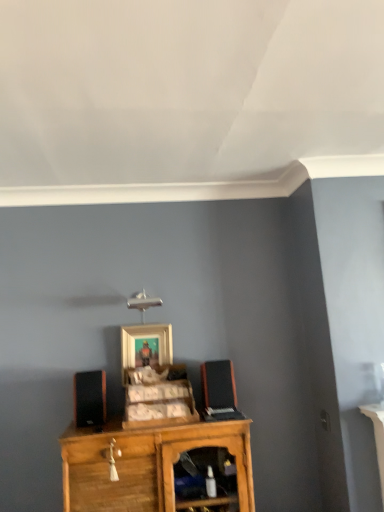
The height and width of the screenshot is (512, 384). What do you see at coordinates (145, 347) in the screenshot?
I see `wooden picture frame at center` at bounding box center [145, 347].

Where is `black matte speaker at right, marked as the 1th speaker in a right-to-left arrangement`? This screenshot has width=384, height=512. black matte speaker at right, marked as the 1th speaker in a right-to-left arrangement is located at coordinates (218, 384).

What do you see at coordinates (218, 384) in the screenshot?
I see `black matte speaker at right, which is the second speaker in left-to-right order` at bounding box center [218, 384].

Measure the distance between point (144,408) and camera.

2.04 meters.

I want to click on wooden picture frame at center, so click(x=145, y=347).

Which object is more forward, wooden cabinet at center or wooden cabinet at center?

Positioned in front is wooden cabinet at center.

Does point (212, 426) lie behind point (153, 416)?

No.

Is wooden cabinet at center turned away from wooden cabinet at center?

No, wooden cabinet at center is not facing the opposite direction of wooden cabinet at center.

From a real-world perspective, is wooden picture frame at center above or below black matte speaker at right, which is the second speaker in left-to-right order?

From a real-world perspective, wooden picture frame at center is physically above black matte speaker at right, which is the second speaker in left-to-right order.

Is wooden picture frame at center taller than black matte speaker at right, marked as the 1th speaker in a right-to-left arrangement?

Correct, wooden picture frame at center is much taller as black matte speaker at right, marked as the 1th speaker in a right-to-left arrangement.

From the picture: Is wooden picture frame at center not within black matte speaker at right, marked as the 1th speaker in a right-to-left arrangement?

Yes, wooden picture frame at center is outside of black matte speaker at right, marked as the 1th speaker in a right-to-left arrangement.

You are a GUI agent. You are given a task and a screenshot of the screen. Output one action in this format:
    pyautogui.click(x=<x>, y=<y>)
    Task: Click on the picture frame above the black matte speaker at right, marked as the 1th speaker in a right-to-left arrangement (from the image's perspective)
    The height and width of the screenshot is (512, 384).
    Given the screenshot: What is the action you would take?
    pyautogui.click(x=145, y=347)

Is wooden picture frame at center wider or thinner than wooden cabinet at center?

wooden picture frame at center is thinner than wooden cabinet at center.

Which is closer to the camera, (156, 351) or (90, 448)?

Point (156, 351) is farther from the camera than point (90, 448).

From a real-world perspective, which object stands above the other?

wooden picture frame at center is physically above.

Is wooden picture frame at center smaller than wooden cabinet at center?

Correct, wooden picture frame at center occupies less space than wooden cabinet at center.

From a real-world perspective, is black matte speaker at left, the second speaker positioned from the right, physically above wooden cabinet at center?

Yes, from a real-world perspective, black matte speaker at left, the second speaker positioned from the right, is above wooden cabinet at center.

Measure the distance from black matte speaker at left, positioned as the 1th speaker in left-to-right order, to wooden cabinet at center.

10.37 inches.

Could you tell me if black matte speaker at left, the second speaker positioned from the right, is facing wooden cabinet at center?

No, black matte speaker at left, the second speaker positioned from the right, is not turned towards wooden cabinet at center.

Is there a large distance between black matte speaker at left, positioned as the 1th speaker in left-to-right order, and wooden cabinet at center?

That's not correct — black matte speaker at left, positioned as the 1th speaker in left-to-right order, is a little close to wooden cabinet at center.

Is wooden picture frame at center at the left side of wooden cabinet at center?

Yes.

Considering the sizes of objects wooden picture frame at center and wooden cabinet at center in the image provided, who is shorter, wooden picture frame at center or wooden cabinet at center?

With less height is wooden cabinet at center.

From a real-world perspective, which is physically below, wooden picture frame at center or wooden cabinet at center?

wooden cabinet at center.

Measure the distance from black matte speaker at left, positioned as the 1th speaker in left-to-right order, to black matte speaker at right, marked as the 1th speaker in a right-to-left arrangement.

The distance of black matte speaker at left, positioned as the 1th speaker in left-to-right order, from black matte speaker at right, marked as the 1th speaker in a right-to-left arrangement, is 23.47 inches.

From the image's perspective, would you say black matte speaker at left, positioned as the 1th speaker in left-to-right order, is shown under black matte speaker at right, which is the second speaker in left-to-right order?

Indeed, from the image's perspective, black matte speaker at left, positioned as the 1th speaker in left-to-right order, is shown beneath black matte speaker at right, which is the second speaker in left-to-right order.

Is black matte speaker at left, positioned as the 1th speaker in left-to-right order, in front of or behind black matte speaker at right, marked as the 1th speaker in a right-to-left arrangement, in the image?

Visually, black matte speaker at left, positioned as the 1th speaker in left-to-right order, is located in front of black matte speaker at right, marked as the 1th speaker in a right-to-left arrangement.

Looking at the image, does black matte speaker at left, positioned as the 1th speaker in left-to-right order, seem bigger or smaller compared to black matte speaker at right, which is the second speaker in left-to-right order?

Considering their sizes, black matte speaker at left, positioned as the 1th speaker in left-to-right order, takes up more space than black matte speaker at right, which is the second speaker in left-to-right order.

How distant is wooden cabinet at center from black matte speaker at left, the second speaker positioned from the right?

10.37 inches.

This screenshot has width=384, height=512. Identify the location of cabinet on the right of black matte speaker at left, positioned as the 1th speaker in left-to-right order. (159, 398).

Is wooden cabinet at center shorter than black matte speaker at left, positioned as the 1th speaker in left-to-right order?

No, wooden cabinet at center is not shorter than black matte speaker at left, positioned as the 1th speaker in left-to-right order.

Is wooden cabinet at center completely or partially outside of black matte speaker at left, the second speaker positioned from the right?

Indeed, wooden cabinet at center is completely outside black matte speaker at left, the second speaker positioned from the right.

Where is `shelf on the right of wooden cabinet at center`? shelf on the right of wooden cabinet at center is located at coordinates (148, 465).

Identify the location of picture frame located on the left of black matte speaker at right, which is the second speaker in left-to-right order. (145, 347).

Based on the photo, considering their positions, is black matte speaker at right, marked as the 1th speaker in a right-to-left arrangement, positioned closer to wooden cabinet at center than wooden picture frame at center?

The object closer to wooden cabinet at center is wooden picture frame at center.

Based on their spatial positions, is black matte speaker at right, which is the second speaker in left-to-right order, or wooden cabinet at center closer to black matte speaker at left, the second speaker positioned from the right?

wooden cabinet at center.

Considering their positions, is wooden cabinet at center positioned closer to wooden cabinet at center than black matte speaker at left, positioned as the 1th speaker in left-to-right order?

The object closer to wooden cabinet at center is wooden cabinet at center.

Estimate the real-world distances between objects in this image. Which object is closer to wooden cabinet at center, wooden cabinet at center or wooden picture frame at center?

Among the two, wooden picture frame at center is located nearer to wooden cabinet at center.

Based on their spatial positions, is black matte speaker at left, positioned as the 1th speaker in left-to-right order, or wooden cabinet at center closer to wooden cabinet at center?

wooden cabinet at center lies closer to wooden cabinet at center than the other object.

Which object lies further to the anchor point wooden picture frame at center, black matte speaker at left, the second speaker positioned from the right, or wooden cabinet at center?

black matte speaker at left, the second speaker positioned from the right, is positioned further to the anchor wooden picture frame at center.

Based on their spatial positions, is wooden picture frame at center or black matte speaker at left, the second speaker positioned from the right, closer to wooden cabinet at center?

wooden picture frame at center is closer to wooden cabinet at center.

Looking at the image, which one is located further to black matte speaker at right, marked as the 1th speaker in a right-to-left arrangement, black matte speaker at left, positioned as the 1th speaker in left-to-right order, or wooden picture frame at center?

black matte speaker at left, positioned as the 1th speaker in left-to-right order, is positioned further to the anchor black matte speaker at right, marked as the 1th speaker in a right-to-left arrangement.

This screenshot has height=512, width=384. In order to click on picture frame between black matte speaker at left, the second speaker positioned from the right, and black matte speaker at right, which is the second speaker in left-to-right order in this screenshot , I will do `click(145, 347)`.

Locate an element on the screen. This screenshot has width=384, height=512. picture frame situated between black matte speaker at left, the second speaker positioned from the right, and wooden cabinet at center from left to right is located at coordinates (145, 347).

Find the location of a particular element. The width and height of the screenshot is (384, 512). shelf situated between black matte speaker at left, the second speaker positioned from the right, and black matte speaker at right, marked as the 1th speaker in a right-to-left arrangement, from left to right is located at coordinates (148, 465).

The image size is (384, 512). Identify the location of cabinet between black matte speaker at left, positioned as the 1th speaker in left-to-right order, and black matte speaker at right, which is the second speaker in left-to-right order, in the horizontal direction. (159, 398).